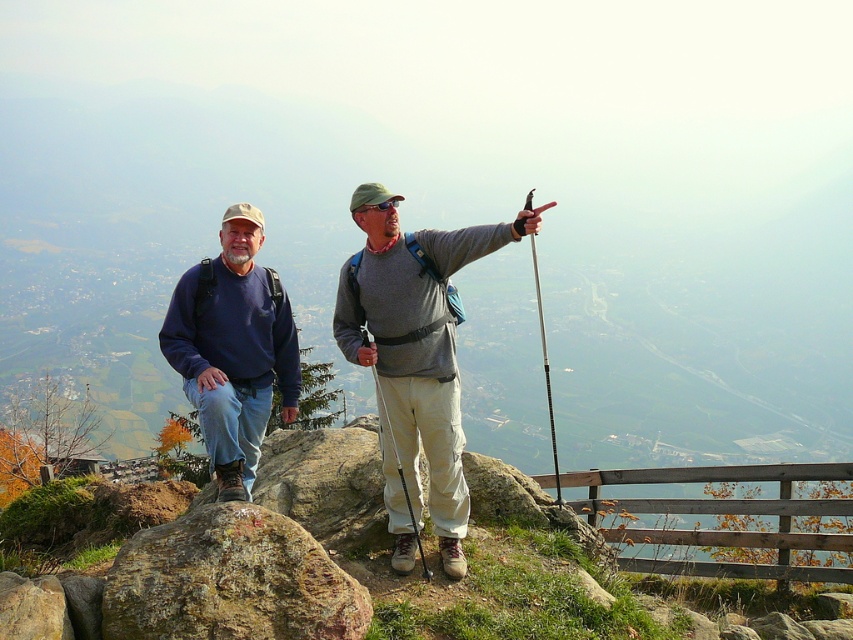
You are a hiker trying to reach the valley below. You see the brown rough rock at lower left and the matte blue sweatshirt at left. Which object is closer to you as you stand on the rocky outcrop?

The brown rough rock at lower left is closer to you because it is in front of the matte blue sweatshirt at left.

You are a photographer planning to take a picture of the two hikers. You notice the brown rough rock at lower left and the matte blue sweatshirt at left. Which object is narrower in width?

The brown rough rock at lower left is thinner than the matte blue sweatshirt at left, so the brown rough rock at lower left is narrower in width.

You are a photographer trying to capture a wide shot of the gray fabric shirt at center and the brown rough rock at lower left. Based on their sizes, which object should you focus on to ensure both fit in the frame without cropping?

The gray fabric shirt at center has a larger width than the brown rough rock at lower left, so you should focus on the gray fabric shirt at center to ensure both fit in the frame without cropping.